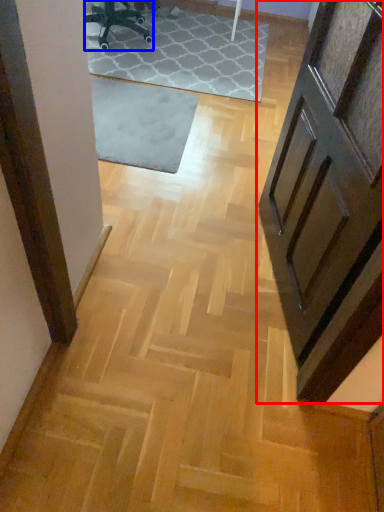
Question: Which of the following is the farthest to the observer, door (highlighted by a red box) or chair (highlighted by a blue box)?

Choices:
 (A) door
 (B) chair

Answer: (B)